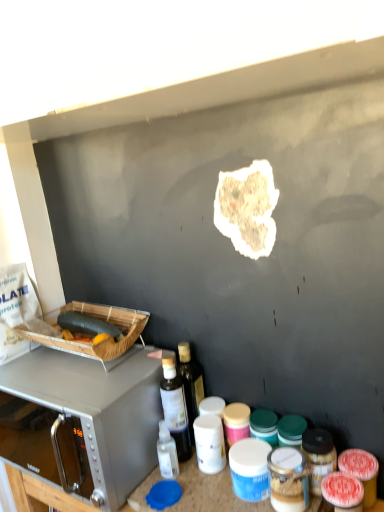
Question: From a real-world perspective, is matte plastic container at center, which is the 1th appliance from bottom to top, located higher than brown crumbly bread at center, the 2th food from the back?

Choices:
 (A) no
 (B) yes

Answer: (A)

Question: Is matte plastic container at center, which is the second appliance from top to bottom, positioned far away from brown crumbly bread at center, the 2th food in the bottom-to-top sequence?

Choices:
 (A) yes
 (B) no

Answer: (B)

Question: Can you confirm if matte plastic container at center, the 2th appliance from the left, is thinner than brown crumbly bread at center, acting as the 1th food starting from the right?

Choices:
 (A) no
 (B) yes

Answer: (A)

Question: Does matte plastic container at center, the 2th appliance from the left, come behind brown crumbly bread at center, which ranks as the 1th food in top-to-bottom order?

Choices:
 (A) no
 (B) yes

Answer: (A)

Question: Is the position of matte plastic container at center, the 2th appliance from the left, less distant than that of brown crumbly bread at center, arranged as the 2th food when viewed from the left?

Choices:
 (A) no
 (B) yes

Answer: (B)

Question: From a real-world perspective, is matte plastic container at center, which is the 1th appliance from bottom to top, under brown crumbly bread at center, which ranks as the 1th food in top-to-bottom order?

Choices:
 (A) no
 (B) yes

Answer: (B)

Question: Can you confirm if satin silver microwave at upper left is wider than green matte zucchini at left, marked as the 2th food in a top-to-bottom arrangement?

Choices:
 (A) no
 (B) yes

Answer: (B)

Question: Could you tell me if satin silver microwave at upper left is facing green matte zucchini at left, placed as the first food when sorted from bottom to top?

Choices:
 (A) yes
 (B) no

Answer: (B)

Question: Is satin silver microwave at upper left at the left side of green matte zucchini at left, which is the second food from right to left?

Choices:
 (A) no
 (B) yes

Answer: (B)

Question: Is satin silver microwave at upper left positioned beyond the bounds of green matte zucchini at left, arranged as the 2th food when viewed from the front?

Choices:
 (A) no
 (B) yes

Answer: (B)

Question: Would you say satin silver microwave at upper left contains green matte zucchini at left, marked as the 2th food in a top-to-bottom arrangement?

Choices:
 (A) no
 (B) yes

Answer: (A)

Question: Would you say satin silver microwave at upper left is a long distance from green matte zucchini at left, which ranks as the 1th food in back-to-front order?

Choices:
 (A) no
 (B) yes

Answer: (A)

Question: Considering the relative positions of satin silver microwave at upper left and matte plastic container at center, which is the second appliance from top to bottom, in the image provided, is satin silver microwave at upper left in front of matte plastic container at center, which is the second appliance from top to bottom,?

Choices:
 (A) yes
 (B) no

Answer: (B)